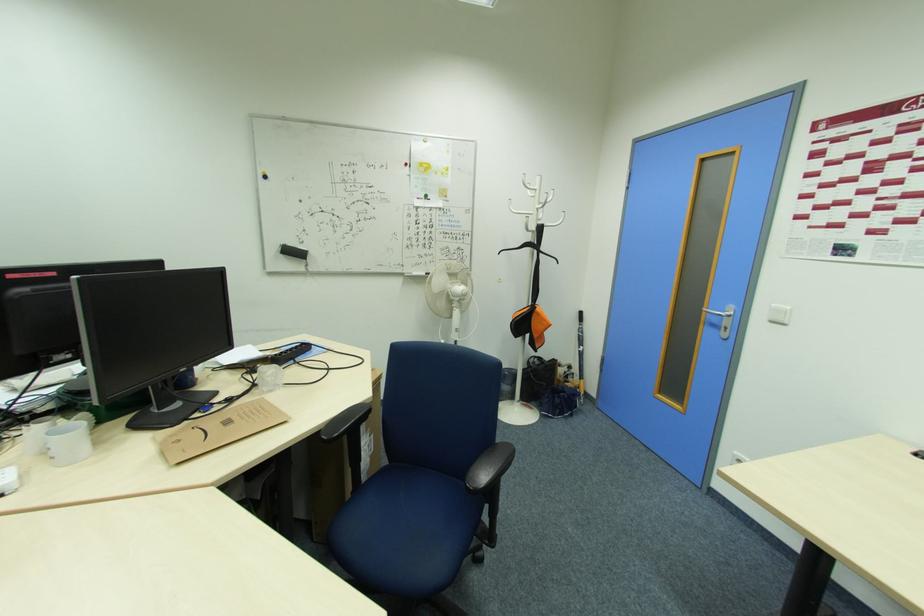
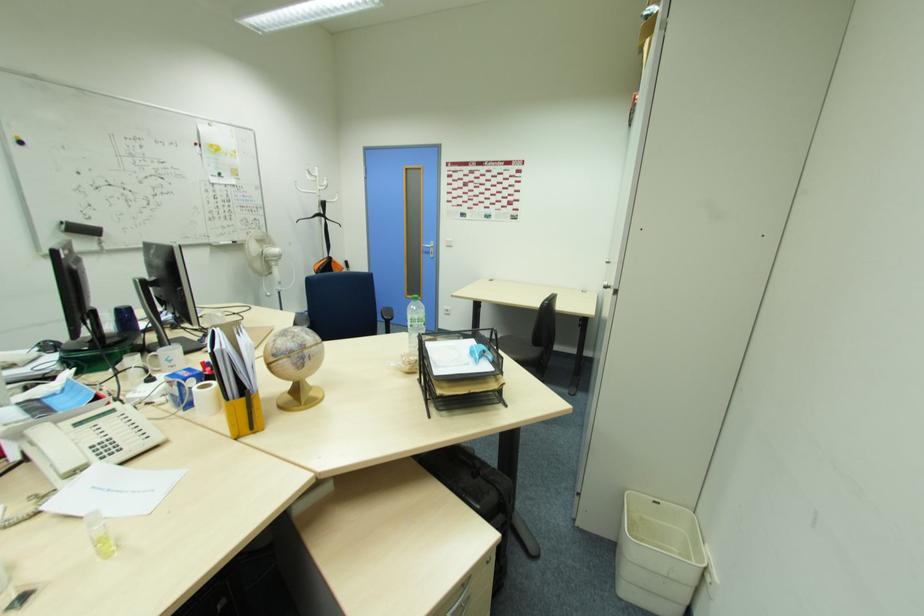
Where in the second image is the point corresponding to point 719,322 from the first image?

(430, 252)